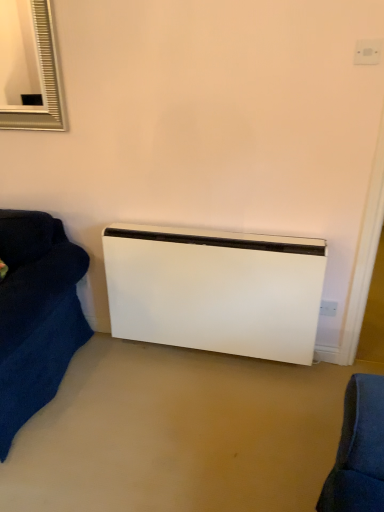
I want to click on white matte radiator at center, so click(215, 290).

What do you see at coordinates (215, 290) in the screenshot? The width and height of the screenshot is (384, 512). I see `white matte radiator at center` at bounding box center [215, 290].

Locate an element on the screen. white matte radiator at center is located at coordinates (215, 290).